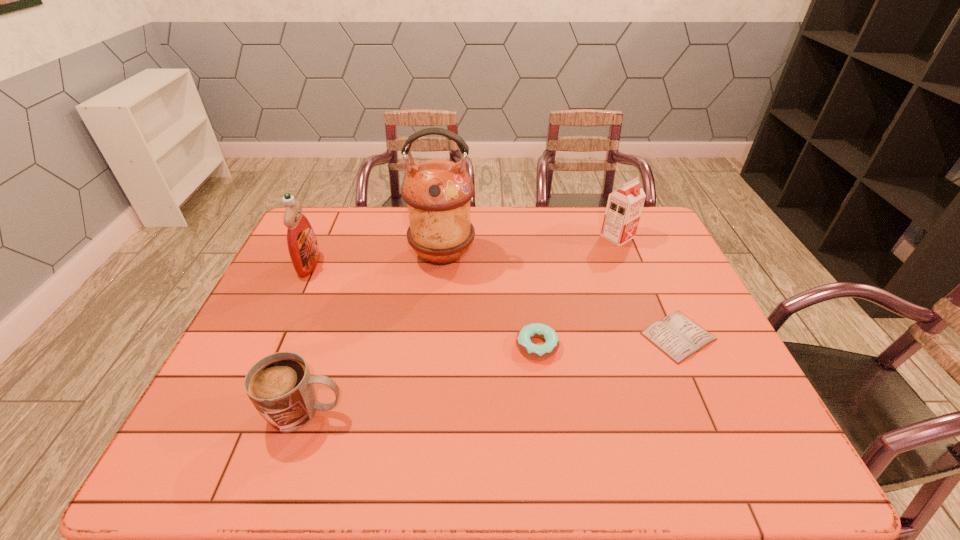
The width and height of the screenshot is (960, 540). What are the coordinates of `soya milk that is at the right edge` in the screenshot? It's located at (624, 206).

Locate an element on the screen. This screenshot has width=960, height=540. diary that is at the right edge is located at coordinates (677, 336).

Locate an element on the screen. Image resolution: width=960 pixels, height=540 pixels. object present at the near left corner is located at coordinates [x=280, y=386].

I want to click on object that is at the far right corner, so click(624, 206).

What are the coordinates of `vacant space at the far edge of the desktop` in the screenshot? It's located at (520, 230).

Find the location of a particular element. free region at the near edge of the desktop is located at coordinates 492,455.

Locate an element on the screen. vacant space at the left edge is located at coordinates (210, 408).

At what (x,y) coordinates should I click in order to perform the action: click on vacant space at the right edge of the desktop. Please return your answer as a coordinate pair (x, y). The width and height of the screenshot is (960, 540). Looking at the image, I should click on (692, 402).

Image resolution: width=960 pixels, height=540 pixels. Identify the location of free space at the far left corner of the desktop. (327, 240).

The image size is (960, 540). What are the coordinates of `vacant point at the far right corner` in the screenshot? It's located at (646, 244).